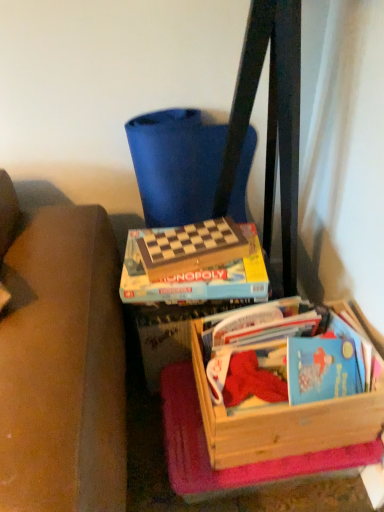
Question: Is wooden paperback book at center at the right side of wooden crate at lower right?

Choices:
 (A) no
 (B) yes

Answer: (A)

Question: Considering the relative sizes of wooden paperback book at center and wooden crate at lower right in the image provided, is wooden paperback book at center shorter than wooden crate at lower right?

Choices:
 (A) no
 (B) yes

Answer: (B)

Question: Is wooden paperback book at center looking in the opposite direction of wooden crate at lower right?

Choices:
 (A) no
 (B) yes

Answer: (A)

Question: From a real-world perspective, is wooden paperback book at center beneath wooden crate at lower right?

Choices:
 (A) no
 (B) yes

Answer: (A)

Question: From a real-world perspective, is wooden paperback book at center on wooden crate at lower right?

Choices:
 (A) no
 (B) yes

Answer: (B)

Question: Based on their positions, is wooden paperback book at center located to the left or right of blue fabric folding chair at upper center?

Choices:
 (A) left
 (B) right

Answer: (A)

Question: From the image's perspective, is wooden paperback book at center positioned above or below blue fabric folding chair at upper center?

Choices:
 (A) below
 (B) above

Answer: (A)

Question: Is point [215, 243] closer or farther from the camera than point [203, 209]?

Choices:
 (A) closer
 (B) farther

Answer: (A)

Question: Would you say wooden paperback book at center is inside or outside blue fabric folding chair at upper center?

Choices:
 (A) inside
 (B) outside

Answer: (B)

Question: From the image's perspective, is wooden paperback book at center above or below wooden crate at lower right?

Choices:
 (A) above
 (B) below

Answer: (A)

Question: In terms of height, does wooden paperback book at center look taller or shorter compared to wooden crate at lower right?

Choices:
 (A) short
 (B) tall

Answer: (A)

Question: In terms of size, does wooden paperback book at center appear bigger or smaller than wooden crate at lower right?

Choices:
 (A) small
 (B) big

Answer: (A)

Question: Considering their positions, is wooden paperback book at center located in front of or behind wooden crate at lower right?

Choices:
 (A) front
 (B) behind

Answer: (B)

Question: Looking at their shapes, would you say blue fabric folding chair at upper center is wider or thinner than wooden crate at lower right?

Choices:
 (A) wide
 (B) thin

Answer: (B)

Question: In the image, is blue fabric folding chair at upper center on the left side or the right side of wooden crate at lower right?

Choices:
 (A) left
 (B) right

Answer: (A)